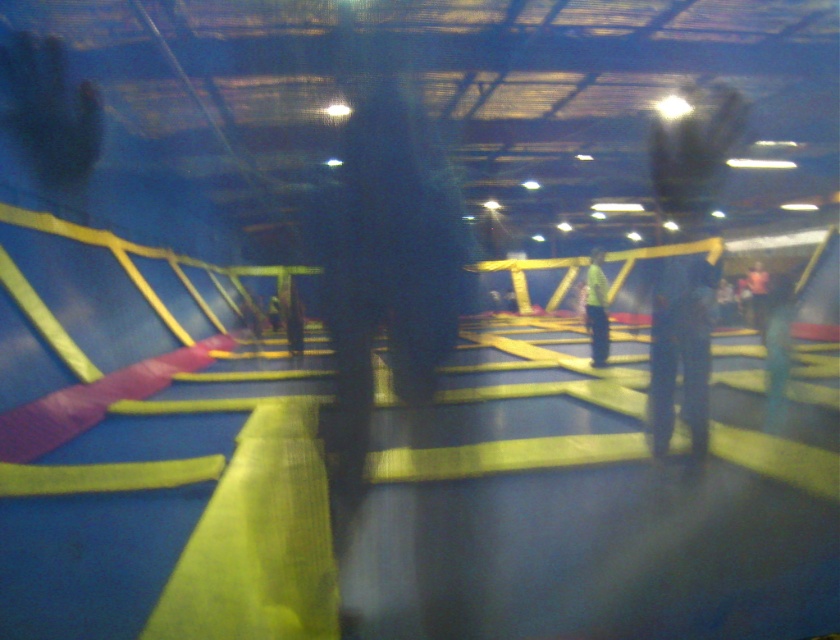
Can you confirm if yellow matte shirt at center is taller than dark brown leather jacket at center?

Correct, yellow matte shirt at center is much taller as dark brown leather jacket at center.

Is point (594, 276) behind point (764, 305)?

No, (594, 276) is closer to viewer.

What do you see at coordinates (596, 308) in the screenshot? This screenshot has width=840, height=640. I see `yellow matte shirt at center` at bounding box center [596, 308].

The image size is (840, 640). What are the coordinates of `yellow matte shirt at center` in the screenshot? It's located at (596, 308).